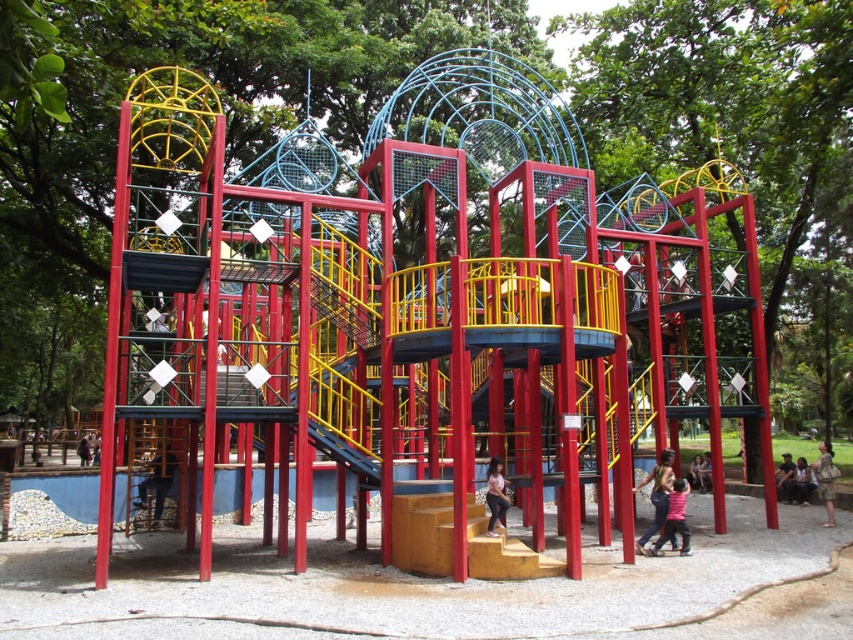
You are a photographer trying to capture both the matte black shirt at lower left and the pink fabric dress at center in a single shot. Since you want to ensure both are clearly visible, which subject should you focus on first to account for their size difference?

The matte black shirt at lower left is bigger than the pink fabric dress at center, so you should focus on the matte black shirt at lower left first to ensure its details are sharp before adjusting for the smaller pink fabric dress at center.

You are a parent trying to locate your child in the playground. You see a matte black shirt at lower left and a pink fabric dress at center. Which one is closer to you?

The matte black shirt at lower left is closer to you because it is in front of the pink fabric dress at center.

You are standing at the playground and see a child wearing a pink matte shirt at lower center. If you want to wave to them, will you be able to see their face clearly from your current position?

The pink matte shirt at lower center and viewer are 11.04 meters apart. Since the distance is relatively far, it might be difficult to see the child wearing the pink matte shirt at lower center clearly from that distance.